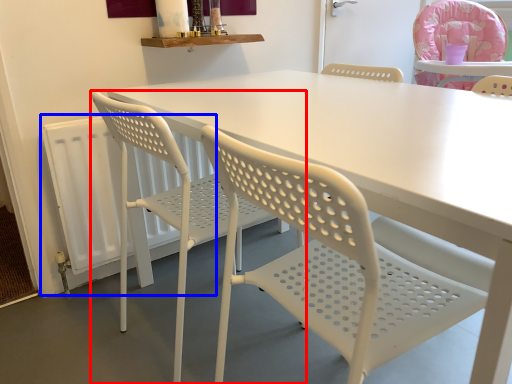
Question: Among these objects, which one is nearest to the camera, chair (highlighted by a red box) or radiator (highlighted by a blue box)?

Choices:
 (A) chair
 (B) radiator

Answer: (A)